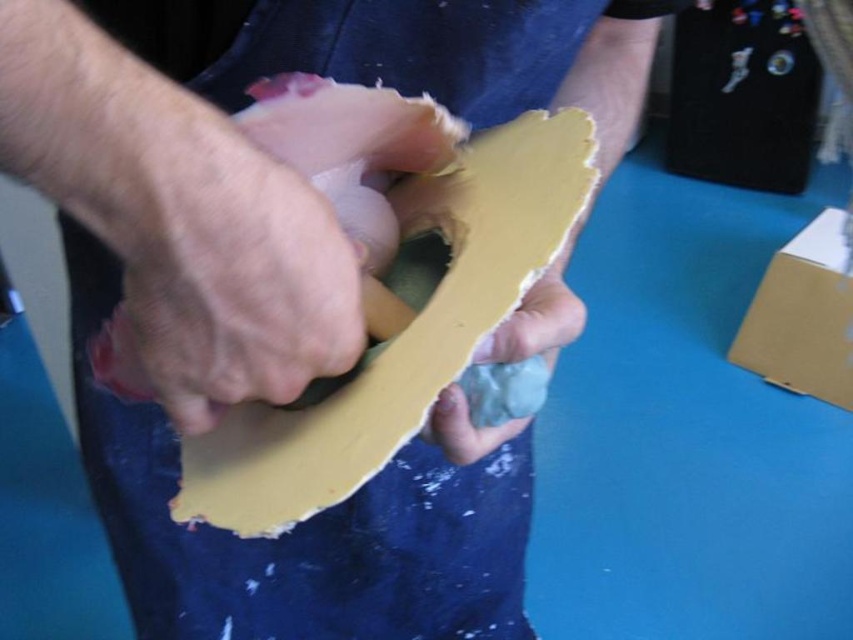
You are an artist working on a sculpture. You need to place the matte yellow sandpaper at center onto the matte cardboard box at lower right. Can you do this without moving the box?

The matte cardboard box at lower right is further to the viewer than the matte yellow sandpaper at center, so yes, you can place the matte yellow sandpaper at center onto the matte cardboard box at lower right without moving the box.

You are an artist working on a sculpture. You have two tools at your disposal, the matte yellow sandpaper at center and the matte yellow paper at center. Which tool is positioned higher on your work surface?

The matte yellow sandpaper at center is located above the matte yellow paper at center, so it is positioned higher on the work surface.

You are organizing a craft station and need to place the matte cardboard box at lower right and the matte yellow paper at center. If the table space is limited, which object should you prioritize moving to ensure there is enough room for both?

The matte cardboard box at lower right might be wider than the matte yellow paper at center, so it should be prioritized for moving to save space.